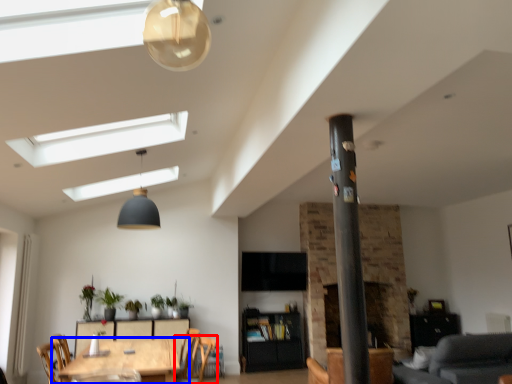
Question: Which object appears closest to the camera in this image, chair (highlighted by a red box) or table (highlighted by a blue box)?

Choices:
 (A) chair
 (B) table

Answer: (B)